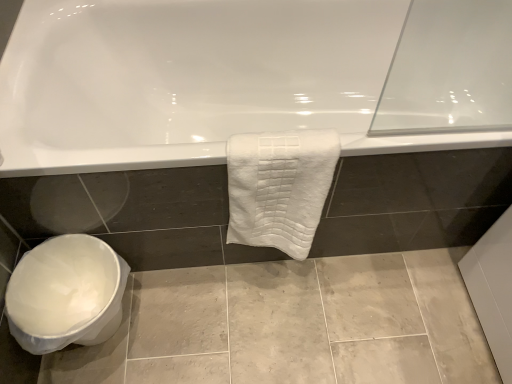
Question: From the image's perspective, does white glossy bathtub at upper center appear higher than gray marble tile at lower left?

Choices:
 (A) no
 (B) yes

Answer: (B)

Question: Is white glossy bathtub at upper center smaller than gray marble tile at lower left?

Choices:
 (A) yes
 (B) no

Answer: (B)

Question: Can you confirm if white glossy bathtub at upper center is shorter than gray marble tile at lower left?

Choices:
 (A) no
 (B) yes

Answer: (A)

Question: Is white glossy bathtub at upper center looking in the opposite direction of gray marble tile at lower left?

Choices:
 (A) no
 (B) yes

Answer: (A)

Question: Does white glossy bathtub at upper center appear on the left side of gray marble tile at lower left?

Choices:
 (A) yes
 (B) no

Answer: (B)

Question: From the image's perspective, is white plastic toilet bowl at lower left positioned above or below white textured towel at center?

Choices:
 (A) above
 (B) below

Answer: (B)

Question: Is point (89, 236) closer or farther from the camera than point (254, 233)?

Choices:
 (A) farther
 (B) closer

Answer: (B)

Question: From a real-world perspective, is white plastic toilet bowl at lower left physically located above or below white textured towel at center?

Choices:
 (A) below
 (B) above

Answer: (A)

Question: Considering the relative positions of white plastic toilet bowl at lower left and white textured towel at center in the image provided, is white plastic toilet bowl at lower left to the left or to the right of white textured towel at center?

Choices:
 (A) right
 (B) left

Answer: (B)

Question: From the image's perspective, is gray marble tile at lower left above or below white plastic toilet bowl at lower left?

Choices:
 (A) above
 (B) below

Answer: (B)

Question: Choose the correct answer: Is gray marble tile at lower left inside white plastic toilet bowl at lower left or outside it?

Choices:
 (A) outside
 (B) inside

Answer: (A)

Question: Would you say gray marble tile at lower left is to the left or to the right of white plastic toilet bowl at lower left in the picture?

Choices:
 (A) right
 (B) left

Answer: (A)

Question: From a real-world perspective, relative to white plastic toilet bowl at lower left, is gray marble tile at lower left vertically above or below?

Choices:
 (A) above
 (B) below

Answer: (B)

Question: Looking at their shapes, would you say white glossy bathtub at upper center is wider or thinner than white textured towel at center?

Choices:
 (A) wide
 (B) thin

Answer: (A)

Question: Is white glossy bathtub at upper center taller or shorter than white textured towel at center?

Choices:
 (A) short
 (B) tall

Answer: (B)